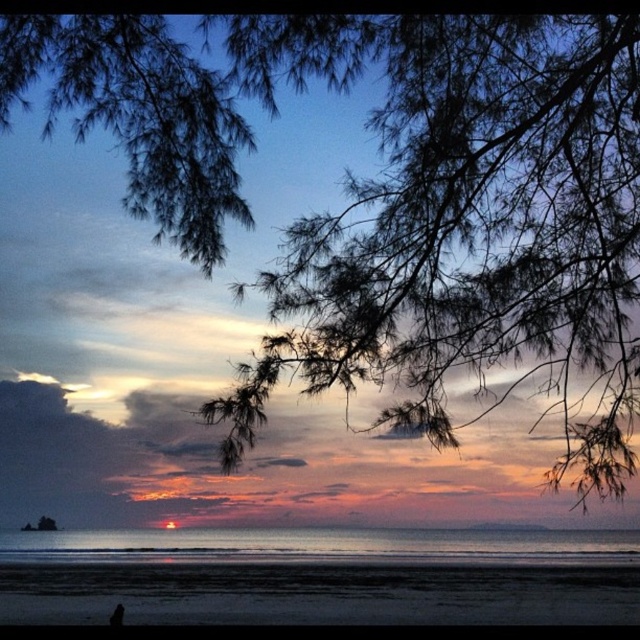
You are standing on the sandy beach at lower center and want to walk towards the black matte person at lower left. Since the beach is wider than the person, will you have enough space to walk around them without stepping into the water?

The sandy beach at lower center is wider than the black matte person at lower left, so there is enough space to walk around them without stepping into the water.

You are a photographer trying to capture the sunset at the beach. You have a camera with a standard lens that can focus on objects up to 5 meters away. You are standing on the sandy beach at lower center and want to take a photo of the black matte person at lower left. Can you focus on the person with your current lens?

The sandy beach at lower center is larger in size than the black matte person at lower left, but the distance between them isn not specified. Without knowing the distance, it is impossible to determine if the lens can focus on the person.